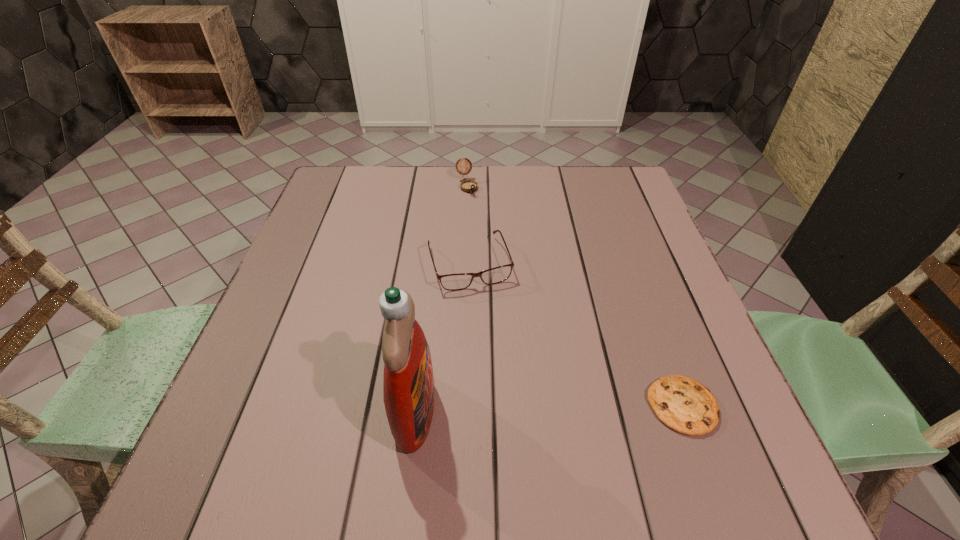
This screenshot has width=960, height=540. I want to click on vacant space on the desktop that is between the tallest object and the cookie and is positioned on the face of the second tallest object, so click(x=580, y=407).

Locate an element on the screen. The height and width of the screenshot is (540, 960). free spot on the desktop that is between the tallest object and the rightmost object and is positioned on the lenses of the second shortest object is located at coordinates (518, 408).